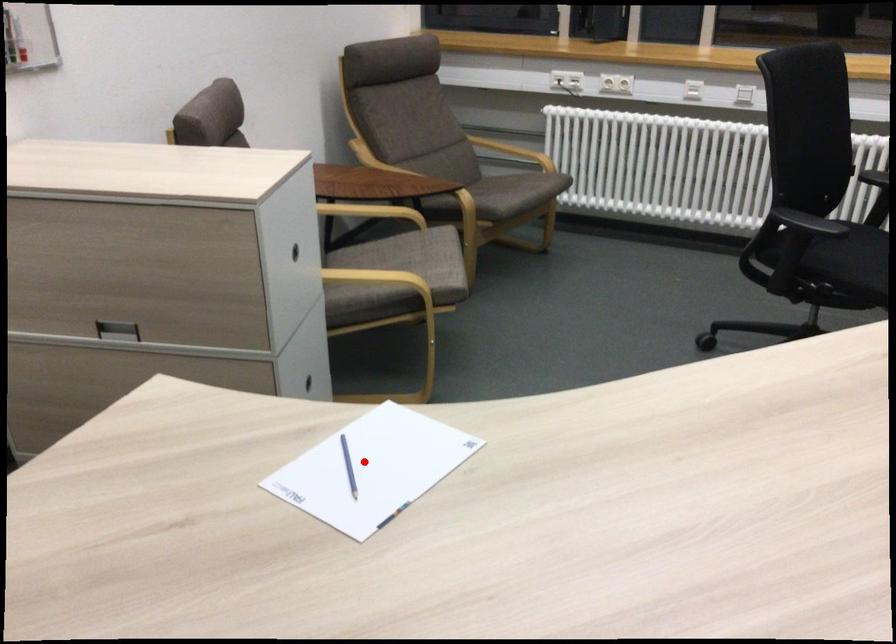
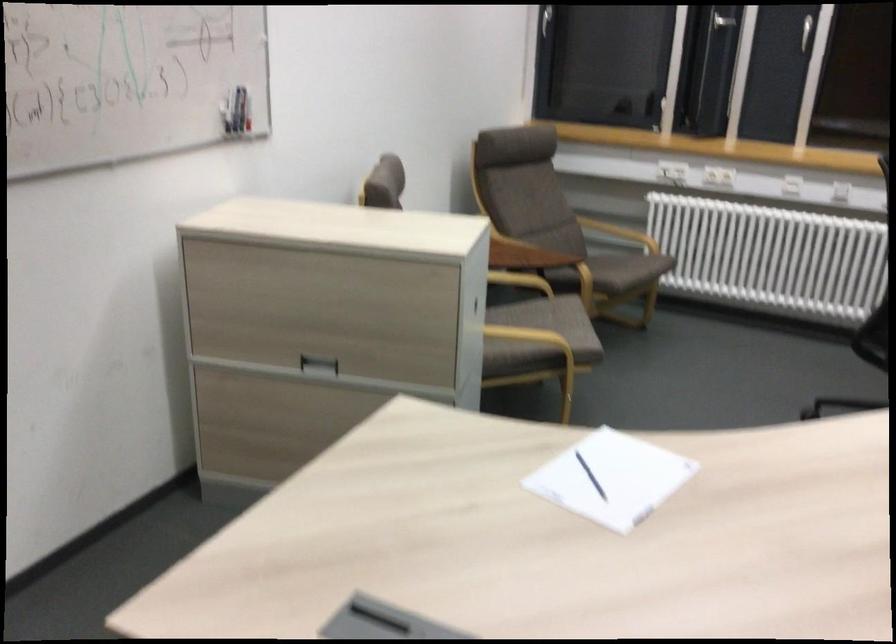
Question: I am providing you with two images of the same scene from different viewpoints. In image1, a red point is highlighted. Considering the same 3D point in image2, which of the following is correct?

Choices:
 (A) It is closer
 (B) It is farther

Answer: (B)